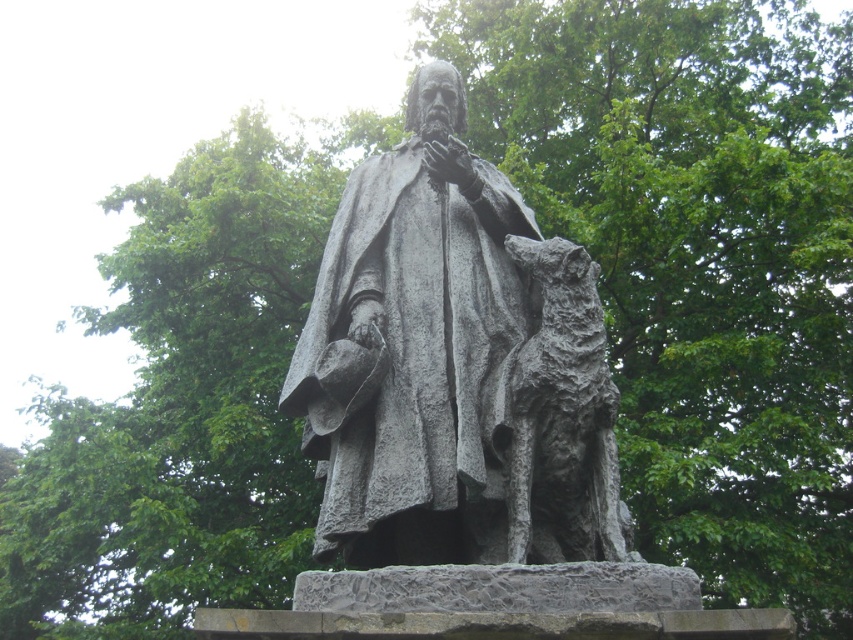
You are a visitor at a park and see the gray stone statue at center and the rough stone dog at center. Which one is closer to you?

The gray stone statue at center is closer to you because it is in front of the rough stone dog at center.

You are standing in a garden and see the gray stone statue at center. If you walk straight ahead, will you reach the statue before the dense trees in the background?

The gray stone statue at center is located at point (456, 365), which places it closer to the viewer than the dense trees in the background. Therefore, you will reach the statue before the trees.